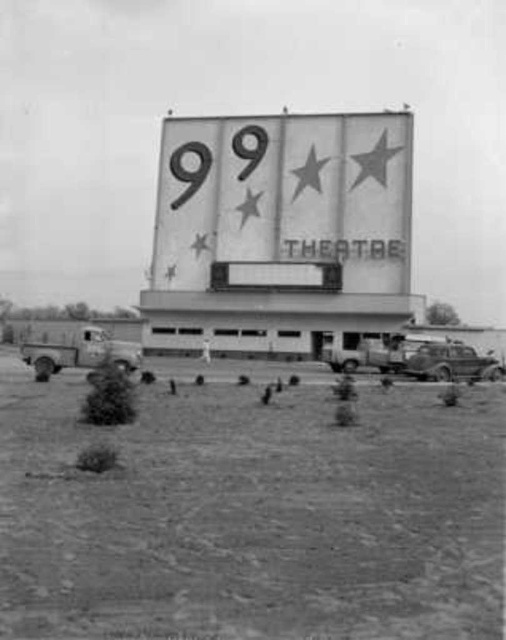
You are standing in front of the vintage outdoor theater scene. You see a metallic silver sign at center and a shiny chrome sedan at right. Which object is wider from your perspective?

The metallic silver sign at center might be wider than the shiny chrome sedan at right according to the description.

You are standing in front of the vintage theater sign. You notice two points marked on the sign. The first point is at coordinates point (65, 400) and the second is at point (467, 364). Which point is closer to you?

Point (65, 400) is in front of point (467, 364), so it is closer to you.

From the picture: You are standing at a distance of 70 meters from the camera. You want to move closer to the point marked at coordinates point (123, 518). Will you be able to reach the point without moving past it?

The distance of point (123, 518) from camera is 68.38 meters. Since you are currently 70 meters away, moving closer by 1.62 meters will bring you to the point without exceeding it.